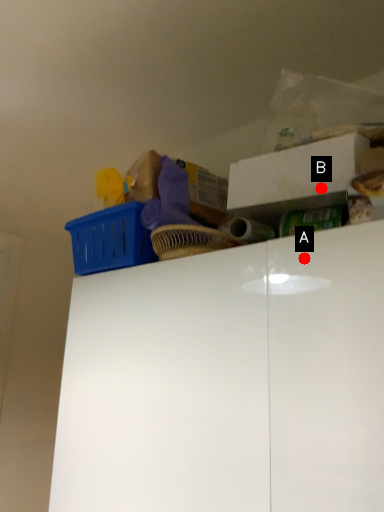
Question: Two points are circled on the image, labeled by A and B beside each circle. Among these points, which one is nearest to the camera?

Choices:
 (A) A is closer
 (B) B is closer

Answer: (A)